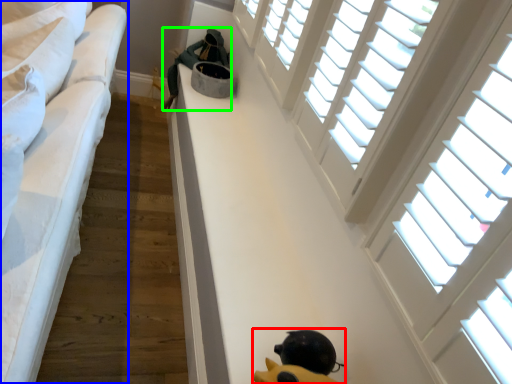
Question: Which object is positioned closest to toy (highlighted by a red box)? Select from furniture (highlighted by a blue box) and person (highlighted by a green box).

Choices:
 (A) furniture
 (B) person

Answer: (A)